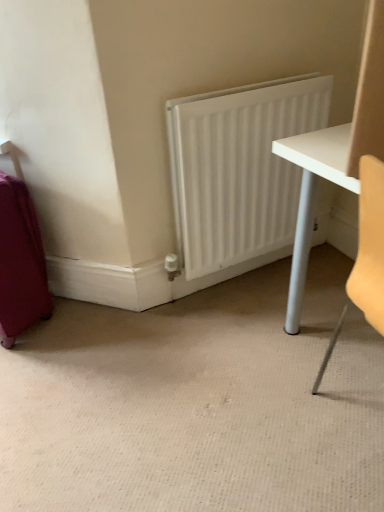
This screenshot has height=512, width=384. Find the location of `free area below white matte radiator at center (from a real-world perspective)`. free area below white matte radiator at center (from a real-world perspective) is located at coordinates (242, 273).